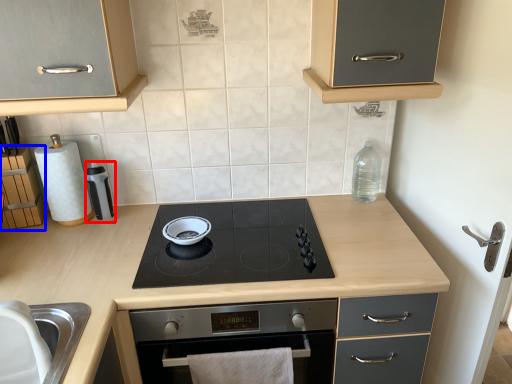
Question: Which point is further to the camera, appliance (highlighted by a red box) or cabinetry (highlighted by a blue box)?

Choices:
 (A) appliance
 (B) cabinetry

Answer: (A)